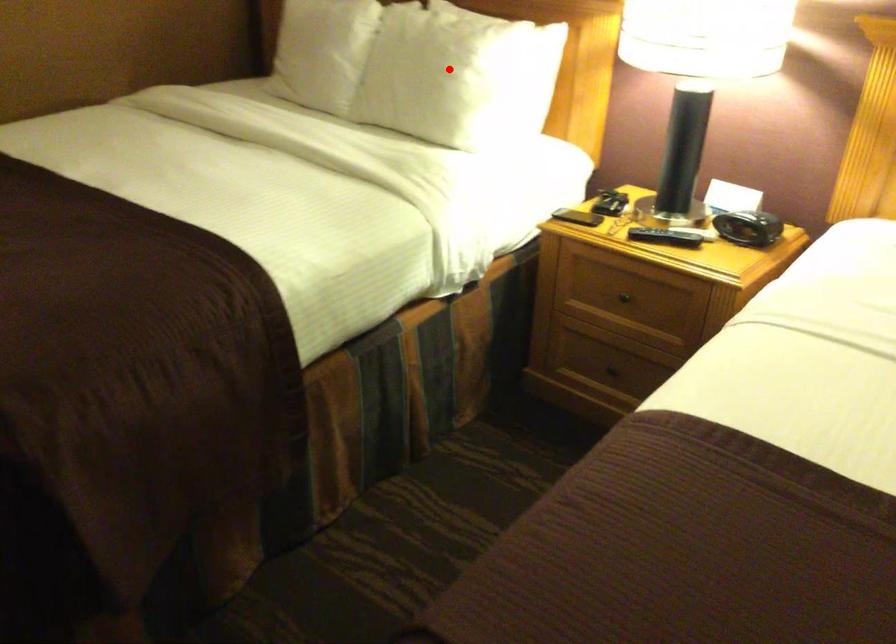
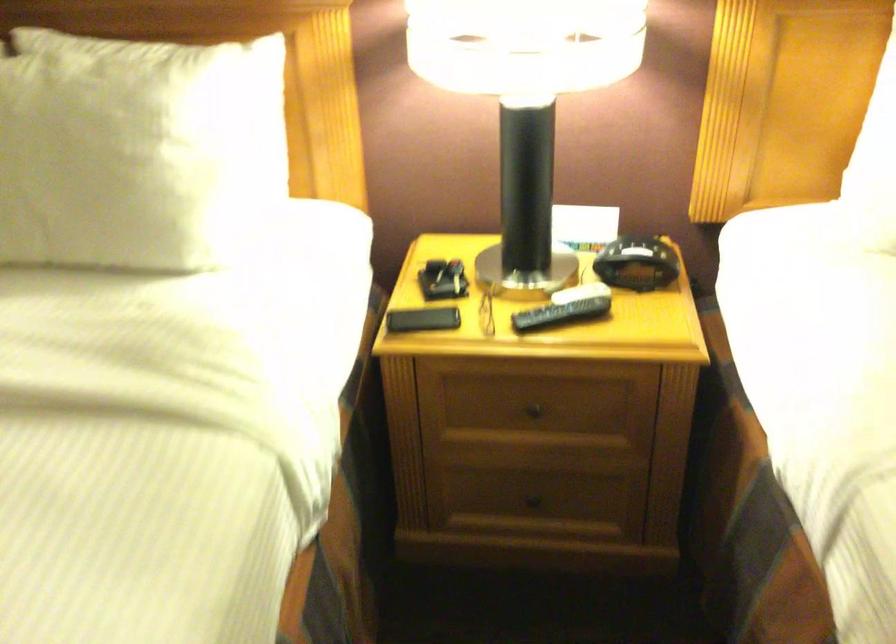
Question: I am providing you with two images of the same scene from different viewpoints. Given a red point in image1, look at the same physical point in image2. Is it:

Choices:
 (A) Closer to the viewpoint
 (B) Farther from the viewpoint

Answer: (A)